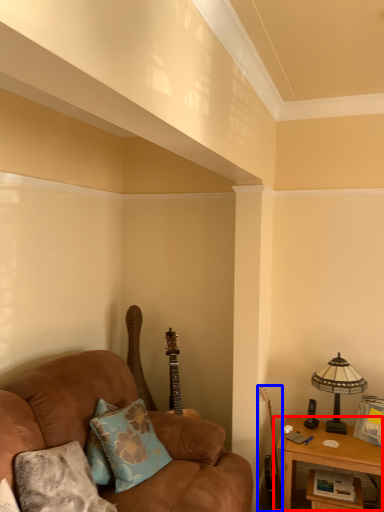
Question: Which object appears farthest to the camera in this image, table (highlighted by a red box) or guitar (highlighted by a blue box)?

Choices:
 (A) table
 (B) guitar

Answer: (B)